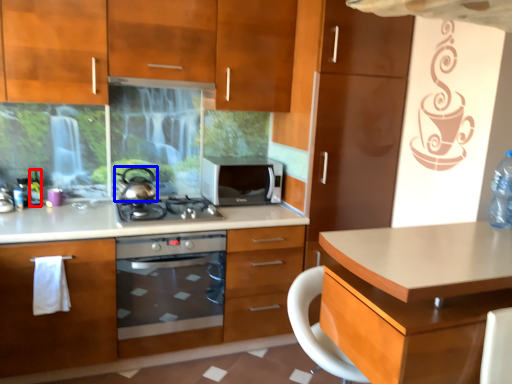
Question: Which object is closer to the camera taking this photo, bottle (highlighted by a red box) or kitchen appliance (highlighted by a blue box)?

Choices:
 (A) bottle
 (B) kitchen appliance

Answer: (B)